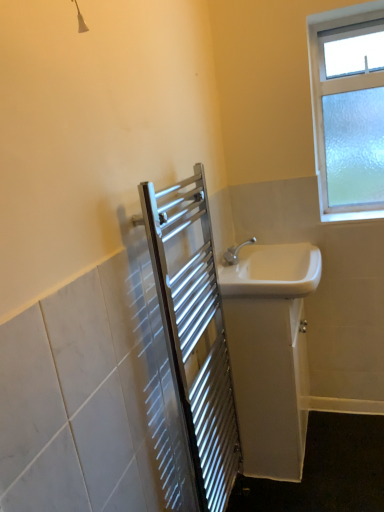
Question: Should I look upward or downward to see frosted glass window at upper right?

Choices:
 (A) down
 (B) up

Answer: (B)

Question: Is white glossy sink at right, the 2th sink from the top, to the right of frosted glass window at upper right from the viewer's perspective?

Choices:
 (A) yes
 (B) no

Answer: (B)

Question: Can you confirm if white glossy sink at right, the 2th sink from the top, is shorter than frosted glass window at upper right?

Choices:
 (A) yes
 (B) no

Answer: (A)

Question: Are white glossy sink at right, the 2th sink from the top, and frosted glass window at upper right far apart?

Choices:
 (A) yes
 (B) no

Answer: (B)

Question: Considering the relative sizes of white glossy sink at right, the 2th sink from the top, and frosted glass window at upper right in the image provided, is white glossy sink at right, the 2th sink from the top, taller than frosted glass window at upper right?

Choices:
 (A) no
 (B) yes

Answer: (A)

Question: Considering the relative sizes of white glossy sink at right, the first sink in the bottom-to-top sequence, and frosted glass window at upper right in the image provided, is white glossy sink at right, the first sink in the bottom-to-top sequence, wider than frosted glass window at upper right?

Choices:
 (A) yes
 (B) no

Answer: (A)

Question: From a real-world perspective, is white glossy sink at right, the first sink in the bottom-to-top sequence, positioned under frosted glass window at upper right based on gravity?

Choices:
 (A) no
 (B) yes

Answer: (B)

Question: Does polished stainless steel towel rack at center-left turn towards frosted glass window at upper right?

Choices:
 (A) no
 (B) yes

Answer: (A)

Question: Would you say polished stainless steel towel rack at center-left contains frosted glass window at upper right?

Choices:
 (A) yes
 (B) no

Answer: (B)

Question: Considering the relative positions of polished stainless steel towel rack at center-left and frosted glass window at upper right in the image provided, is polished stainless steel towel rack at center-left to the right of frosted glass window at upper right from the viewer's perspective?

Choices:
 (A) no
 (B) yes

Answer: (A)

Question: Does polished stainless steel towel rack at center-left have a larger size compared to frosted glass window at upper right?

Choices:
 (A) yes
 (B) no

Answer: (A)

Question: Does polished stainless steel towel rack at center-left appear on the left side of frosted glass window at upper right?

Choices:
 (A) yes
 (B) no

Answer: (A)

Question: Can we say polished stainless steel towel rack at center-left lies outside frosted glass window at upper right?

Choices:
 (A) no
 (B) yes

Answer: (B)

Question: Is white glossy sink at right, arranged as the first sink when viewed from the top, taller than white glossy sink at right, the first sink in the bottom-to-top sequence?

Choices:
 (A) no
 (B) yes

Answer: (A)